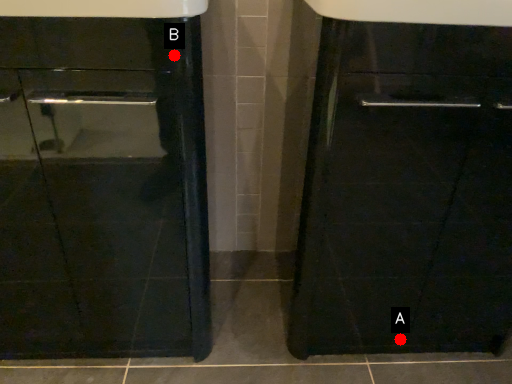
Question: Two points are circled on the image, labeled by A and B beside each circle. Which point is closer to the camera taking this photo?

Choices:
 (A) A is closer
 (B) B is closer

Answer: (B)